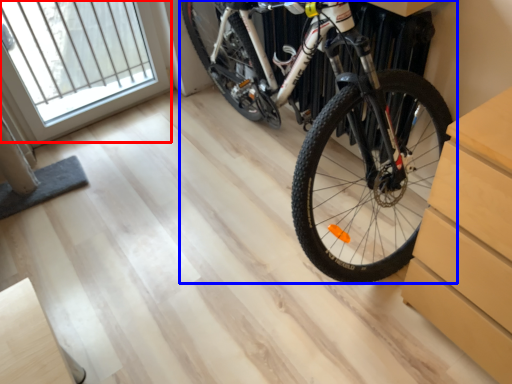
Question: Which of the following is the farthest to the observer, window (highlighted by a red box) or bicycle (highlighted by a blue box)?

Choices:
 (A) window
 (B) bicycle

Answer: (A)